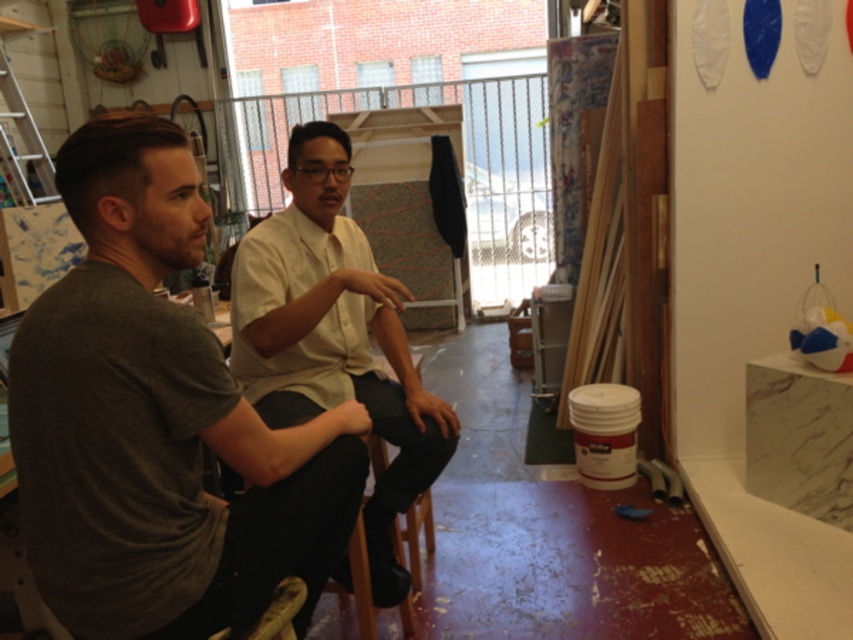
Question: Among these objects, which one is nearest to the camera?

Choices:
 (A) brushed metal ladder at upper left
 (B) wooden stool at center

Answer: (B)

Question: Is the position of white matte shirt at center more distant than that of wooden stool at center?

Choices:
 (A) no
 (B) yes

Answer: (B)

Question: Does white matte shirt at center have a smaller size compared to brushed metal ladder at upper left?

Choices:
 (A) no
 (B) yes

Answer: (B)

Question: Which of these objects is positioned farthest from the dark gray t-shirt at left?

Choices:
 (A) white matte shirt at center
 (B) brushed metal ladder at upper left

Answer: (B)

Question: Based on their relative distances, which object is nearer to the white matte shirt at center?

Choices:
 (A) dark gray t-shirt at left
 (B) brushed metal ladder at upper left
 (C) wooden stool at center

Answer: (C)

Question: Is dark gray t-shirt at left smaller than brushed metal ladder at upper left?

Choices:
 (A) no
 (B) yes

Answer: (B)